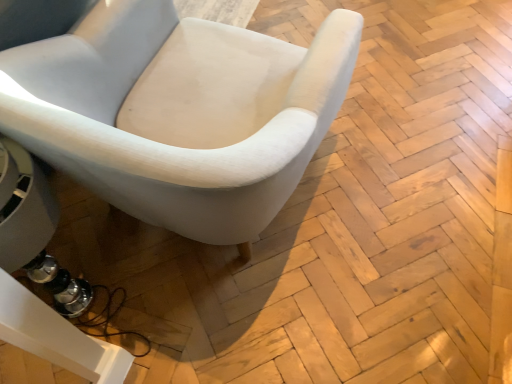
You are a GUI agent. You are given a task and a screenshot of the screen. Output one action in this format:
    pyautogui.click(x=<x>, y=<y>)
    Task: Click on the unoccupied region to the right of white fabric chair at center
    Image resolution: width=512 pixels, height=384 pixels.
    Given the screenshot: What is the action you would take?
    pos(399,192)